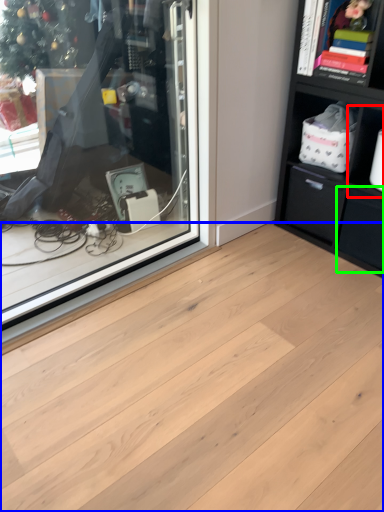
Question: Which is farther away from cabinet (highlighted by a red box)? plank (highlighted by a blue box) or drawer (highlighted by a green box)?

Choices:
 (A) plank
 (B) drawer

Answer: (A)